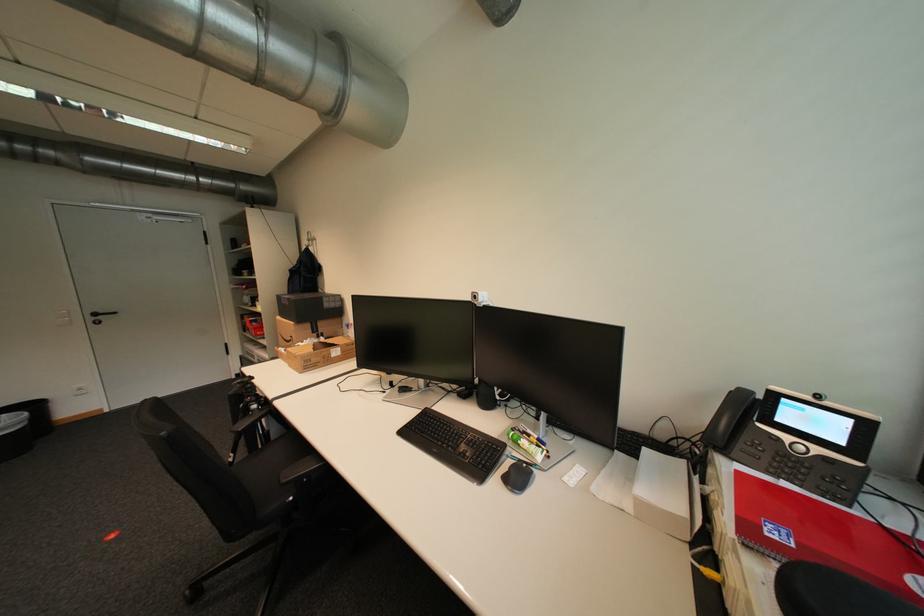
The width and height of the screenshot is (924, 616). In order to click on black computer mouse in this screenshot , I will do `click(517, 477)`.